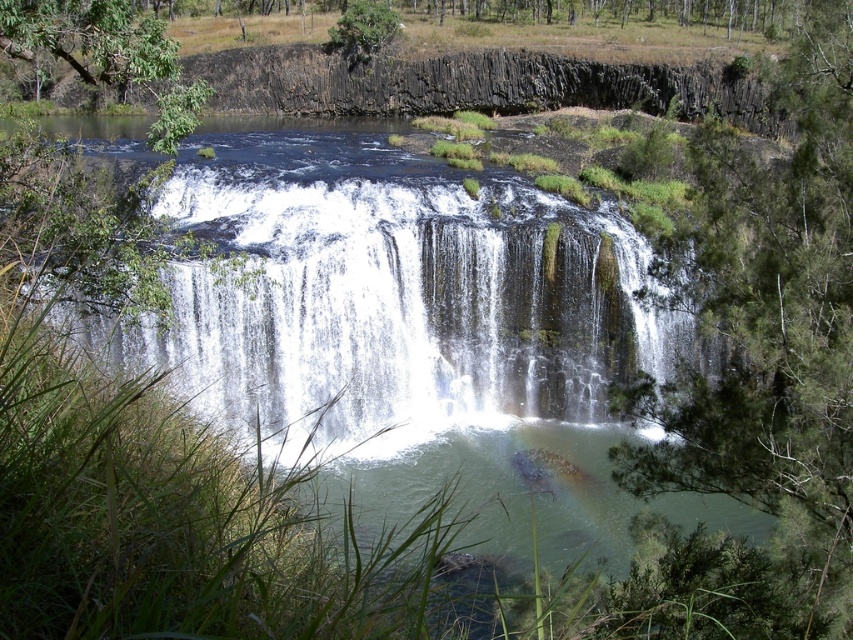
Does point (316, 170) come in front of point (344, 29)?

Yes, it is.

Which is below, white textured waterfall at center or green rough bark tree at upper center?

white textured waterfall at center is lower down.

Is point (502, 346) positioned in front of point (339, 20)?

Yes.

At what (x,y) coordinates should I click in order to perform the action: click on white textured waterfall at center. Please return your answer as a coordinate pair (x, y). This screenshot has width=853, height=640. Looking at the image, I should click on (399, 307).

Is white textured waterfall at center further to camera compared to green leafy tree at upper left?

Yes, white textured waterfall at center is further from the viewer.

Does white textured waterfall at center have a lesser height compared to green leafy tree at upper left?

Indeed, white textured waterfall at center has a lesser height compared to green leafy tree at upper left.

Identify the location of white textured waterfall at center. (399, 307).

Locate an element on the screen. white textured waterfall at center is located at coordinates (399, 307).

Who is more distant from viewer, (808, 385) or (83, 38)?

The point (83, 38) is more distant.

Does green leafy tree at center appear on the left side of green leafy tree at upper left?

No, green leafy tree at center is not to the left of green leafy tree at upper left.

Is point (751, 388) positioned in front of point (93, 20)?

No, it is not.

This screenshot has width=853, height=640. I want to click on green leafy tree at center, so click(x=762, y=368).